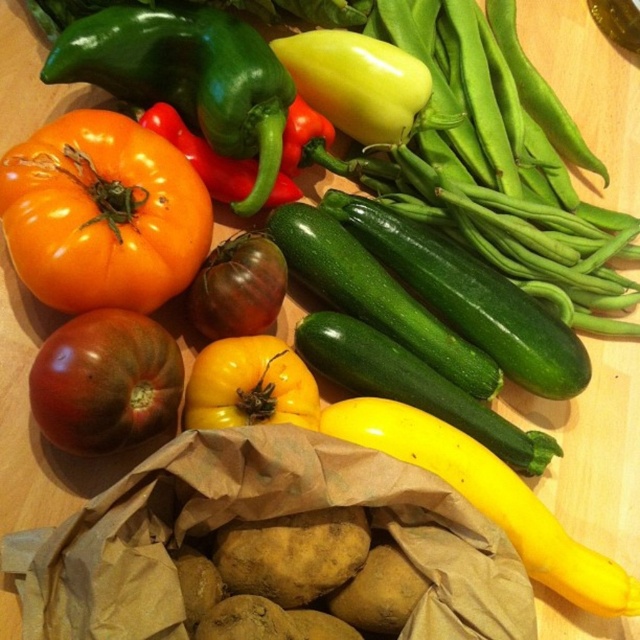
Question: Which of the following is the closest to the observer?

Choices:
 (A) yellow matte tomato at center
 (B) green glossy pepper at upper center
 (C) rustic brown tomato at center-left

Answer: (C)

Question: Is green glossy bell pepper at upper left above yellow matte tomato at center?

Choices:
 (A) yes
 (B) no

Answer: (A)

Question: Which of these objects is positioned farthest from the green glossy bell pepper at upper left?

Choices:
 (A) green glossy pepper at upper center
 (B) yellow matte tomato at center
 (C) rustic brown tomato at center-left

Answer: (C)

Question: Which object is the closest to the green glossy pepper at upper center?

Choices:
 (A) yellow matte tomato at center
 (B) green glossy bell pepper at upper left

Answer: (B)

Question: Is matte orange tomato at center bigger than yellow matte tomato at center?

Choices:
 (A) no
 (B) yes

Answer: (B)

Question: Is rustic brown tomato at center-left positioned at the back of yellow matte tomato at center?

Choices:
 (A) no
 (B) yes

Answer: (A)